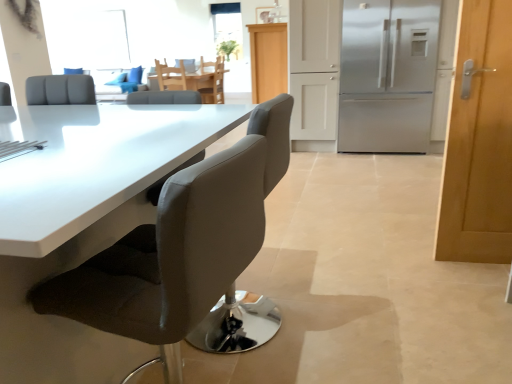
Question: Does suede-like gray chair at center, acting as the second chair starting from the bottom, have a smaller size compared to light wood cabinet at center?

Choices:
 (A) no
 (B) yes

Answer: (B)

Question: From a real-world perspective, is suede-like gray chair at center, acting as the second chair starting from the bottom, beneath light wood cabinet at center?

Choices:
 (A) yes
 (B) no

Answer: (A)

Question: Does suede-like gray chair at center, which is the 3th chair in top-to-bottom order, have a lesser width compared to light wood cabinet at center?

Choices:
 (A) no
 (B) yes

Answer: (B)

Question: Is suede-like gray chair at center, acting as the second chair starting from the bottom, taller than light wood cabinet at center?

Choices:
 (A) yes
 (B) no

Answer: (B)

Question: Is light wood cabinet at center at the back of suede-like gray chair at center, which is the 3th chair in top-to-bottom order?

Choices:
 (A) no
 (B) yes

Answer: (A)

Question: Is wooden round table at center inside the boundaries of wooden door at right, or outside?

Choices:
 (A) inside
 (B) outside

Answer: (B)

Question: From a real-world perspective, is wooden round table at center above or below wooden door at right?

Choices:
 (A) below
 (B) above

Answer: (A)

Question: Considering the positions of point (214, 82) and point (484, 132), is point (214, 82) closer or farther from the camera than point (484, 132)?

Choices:
 (A) farther
 (B) closer

Answer: (A)

Question: Looking at their shapes, would you say wooden round table at center is wider or thinner than wooden door at right?

Choices:
 (A) wide
 (B) thin

Answer: (A)

Question: In terms of height, does wooden door at right look taller or shorter compared to light brown wooden chair at center, acting as the 1th chair starting from the back?

Choices:
 (A) tall
 (B) short

Answer: (A)

Question: From the image's perspective, relative to light brown wooden chair at center, the 4th chair in the front-to-back sequence, is wooden door at right above or below?

Choices:
 (A) below
 (B) above

Answer: (A)

Question: Looking at their shapes, would you say wooden door at right is wider or thinner than light brown wooden chair at center, the 1th chair in the top-to-bottom sequence?

Choices:
 (A) wide
 (B) thin

Answer: (B)

Question: Considering the positions of point (446, 248) and point (206, 89), is point (446, 248) closer or farther from the camera than point (206, 89)?

Choices:
 (A) farther
 (B) closer

Answer: (B)

Question: Considering their positions, is suede-like gray chair at center, acting as the second chair starting from the bottom, located in front of or behind satin silver refrigerator at right?

Choices:
 (A) behind
 (B) front

Answer: (B)

Question: From a real-world perspective, is suede-like gray chair at center, which is the 3th chair in top-to-bottom order, positioned above or below satin silver refrigerator at right?

Choices:
 (A) above
 (B) below

Answer: (B)